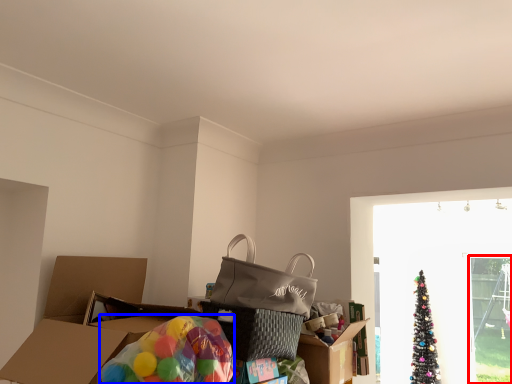
Question: Which of the following is the closest to the observer, screen door (highlighted by a red box) or balloon (highlighted by a blue box)?

Choices:
 (A) screen door
 (B) balloon

Answer: (B)